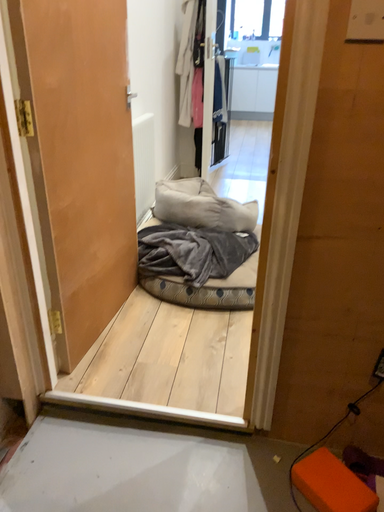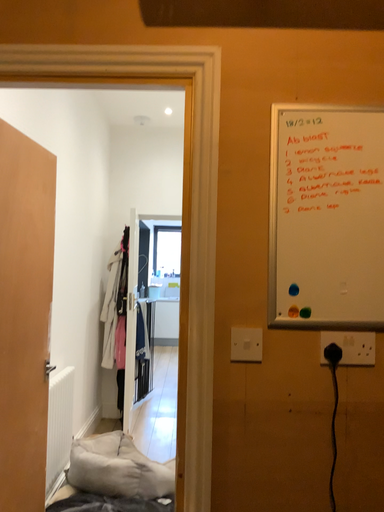
Question: How did the camera likely rotate when shooting the video?

Choices:
 (A) rotated right
 (B) rotated left

Answer: (A)